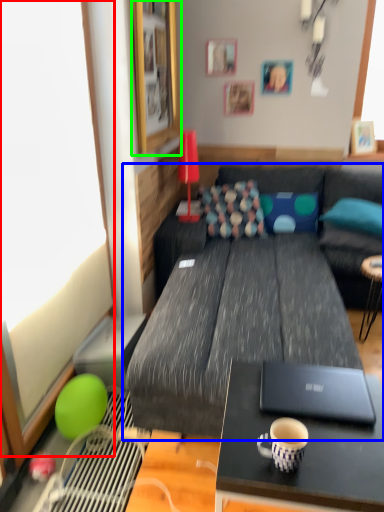
Question: Estimate the real-world distances between objects in this image. Which object is farther from window screen (highlighted by a red box), studio couch (highlighted by a blue box) or picture frame (highlighted by a green box)?

Choices:
 (A) studio couch
 (B) picture frame

Answer: (B)